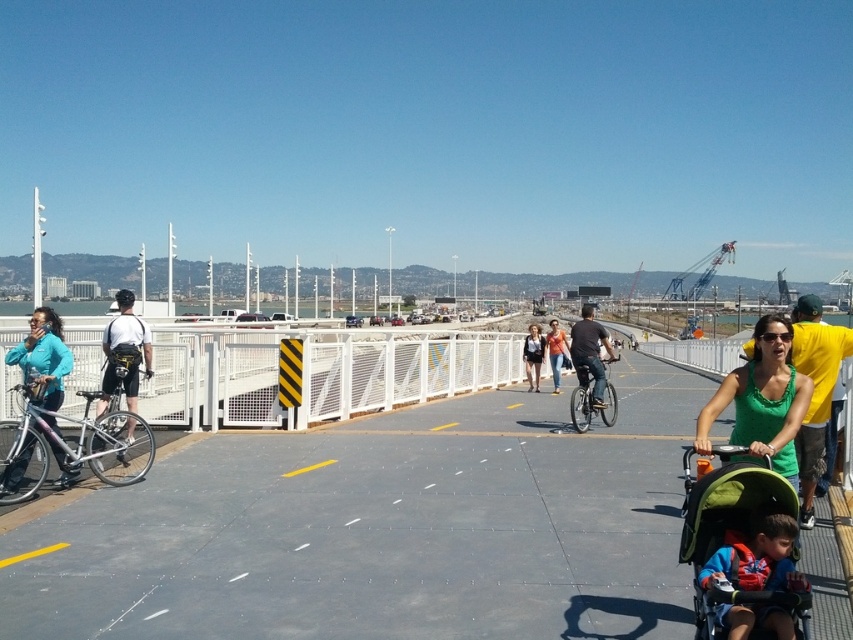
Question: Which point appears farthest from the camera in this image?

Choices:
 (A) (605, 406)
 (B) (142, 346)

Answer: (A)

Question: Does matte black bicycle at center have a greater width compared to matte black tank top at center?

Choices:
 (A) yes
 (B) no

Answer: (B)

Question: Which point is closer to the camera taking this photo?

Choices:
 (A) (599, 406)
 (B) (105, 368)

Answer: (B)

Question: Is matte blue jacket at left closer to the viewer compared to matte black bicycle at center?

Choices:
 (A) no
 (B) yes

Answer: (B)

Question: Is gray concrete path at center bigger than denim jeans at center?

Choices:
 (A) yes
 (B) no

Answer: (A)

Question: Which point appears closest to the camera in this image?

Choices:
 (A) (107, 349)
 (B) (525, 346)
 (C) (186, 472)

Answer: (C)